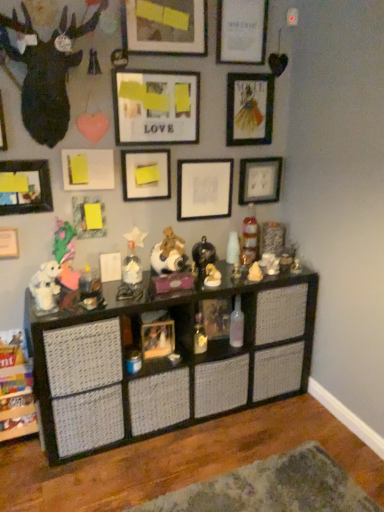
Where is `black matte picture frame at upper right, which is counted as the 8th picture frame, starting from the bottom`? The image size is (384, 512). black matte picture frame at upper right, which is counted as the 8th picture frame, starting from the bottom is located at coordinates (259, 180).

This screenshot has width=384, height=512. Describe the element at coordinates (156, 106) in the screenshot. I see `matte paper picture frame at upper center, which is the 10th picture frame in bottom-to-top order` at that location.

You are a GUI agent. You are given a task and a screenshot of the screen. Output one action in this format:
    pyautogui.click(x=<x>, y=<y>)
    Task: Click on the matte black picture frame at upper center, marked as the 12th picture frame in a bottom-to-top arrangement
    
    Given the screenshot: What is the action you would take?
    pyautogui.click(x=167, y=27)

Measure the distance between white matte dog at center, arranged as the fifth toy when viewed from the right, and camera.

The depth of white matte dog at center, arranged as the fifth toy when viewed from the right, is 7.10 feet.

Describe the element at coordinates (269, 264) in the screenshot. The width and height of the screenshot is (384, 512). I see `white matte figurine at center, acting as the eleventh toy starting from the left` at that location.

Identify the location of black matte picture frame at upper right, which is counted as the 8th picture frame, starting from the bottom. Image resolution: width=384 pixels, height=512 pixels. (259, 180).

Could you measure the distance between transparent glass bottle at center and shiny metallic figurine at center, marked as the sixth toy in a right-to-left arrangement?

transparent glass bottle at center is 32.13 centimeters from shiny metallic figurine at center, marked as the sixth toy in a right-to-left arrangement.

How different are the orientations of transparent glass bottle at center and shiny metallic figurine at center, marked as the sixth toy in a right-to-left arrangement, in degrees?

The angle between the facing direction of transparent glass bottle at center and the facing direction of shiny metallic figurine at center, marked as the sixth toy in a right-to-left arrangement, is 3.28 degrees.

Is transparent glass bottle at center not near shiny metallic figurine at center, marked as the sixth toy in a right-to-left arrangement?

No, transparent glass bottle at center is not far from shiny metallic figurine at center, marked as the sixth toy in a right-to-left arrangement.

Considering the relative sizes of transparent glass bottle at center and shiny metallic figurine at center, the sixth toy from the left, in the image provided, is transparent glass bottle at center bigger than shiny metallic figurine at center, the sixth toy from the left,?

No, transparent glass bottle at center is not bigger than shiny metallic figurine at center, the sixth toy from the left.

Based on the photo, from the image's perspective, is matte yellow paper at center, which is counted as the seventh picture frame, starting from the top, on top of brushed metal picture frame at upper left, the fifth picture frame in the top-to-bottom sequence?

No, from the image's perspective, matte yellow paper at center, which is counted as the seventh picture frame, starting from the top, is not above brushed metal picture frame at upper left, the fifth picture frame in the top-to-bottom sequence.

Does matte yellow paper at center, acting as the 7th picture frame starting from the bottom, have a greater height compared to brushed metal picture frame at upper left, which ranks as the ninth picture frame in bottom-to-top order?

Yes.

Which is closer, (x=145, y=189) or (x=2, y=125)?

The point (x=2, y=125) is more forward.

Could you tell me if matte yellow paper at center, which is counted as the seventh picture frame, starting from the top, is turned towards black matte picture frame at upper right, which ranks as the sixth picture frame in top-to-bottom order?

No.

The image size is (384, 512). Identify the location of the 1st picture frame positioned below the black matte picture frame at upper right, which is counted as the 8th picture frame, starting from the bottom (from the image's perspective). (146, 174).

Is matte yellow paper at center, which is counted as the seventh picture frame, starting from the top, at the right side of black matte picture frame at upper right, which is counted as the 8th picture frame, starting from the bottom?

Incorrect, matte yellow paper at center, which is counted as the seventh picture frame, starting from the top, is not on the right side of black matte picture frame at upper right, which is counted as the 8th picture frame, starting from the bottom.

Considering the sizes of objects matte yellow paper at center, acting as the 7th picture frame starting from the bottom, and black matte picture frame at upper right, which is counted as the 8th picture frame, starting from the bottom, in the image provided, who is shorter, matte yellow paper at center, acting as the 7th picture frame starting from the bottom, or black matte picture frame at upper right, which is counted as the 8th picture frame, starting from the bottom,?

matte yellow paper at center, acting as the 7th picture frame starting from the bottom.

Consider the image. Is wooden picture frame at center, the 2th picture frame from the bottom, looking in the opposite direction of wooden picture frame at center, which appears as the 1th picture frame when ordered from the bottom?

That's not correct — wooden picture frame at center, the 2th picture frame from the bottom, is not looking away from wooden picture frame at center, which appears as the 1th picture frame when ordered from the bottom.

Considering the relative positions of wooden picture frame at center, which is the 12th picture frame from top to bottom, and wooden picture frame at center, the thirteenth picture frame when ordered from top to bottom, in the image provided, is wooden picture frame at center, which is the 12th picture frame from top to bottom, in front of wooden picture frame at center, the thirteenth picture frame when ordered from top to bottom,?

No, the depth of wooden picture frame at center, which is the 12th picture frame from top to bottom, is greater than that of wooden picture frame at center, the thirteenth picture frame when ordered from top to bottom.

Looking at this image, measure the distance from wooden picture frame at center, the 2th picture frame from the bottom, to wooden picture frame at center, which appears as the 1th picture frame when ordered from the bottom.

The distance of wooden picture frame at center, the 2th picture frame from the bottom, from wooden picture frame at center, which appears as the 1th picture frame when ordered from the bottom, is 10.32 inches.

Do you think wooden picture frame at center, which is the 12th picture frame from top to bottom, is within wooden picture frame at center, the thirteenth picture frame when ordered from top to bottom, or outside of it?

The correct answer is: outside.

From the image's perspective, is white fabric stuffed animal at center, which ranks as the eighth toy in right-to-left order, positioned above or below matte white picture frame at upper center, the first picture frame from the top?

white fabric stuffed animal at center, which ranks as the eighth toy in right-to-left order, is below matte white picture frame at upper center, the first picture frame from the top.

Is white fabric stuffed animal at center, the 4th toy positioned from the left, touching matte white picture frame at upper center, the first picture frame from the top?

They are not placed beside each other.

Is point (157, 247) positioned in front of point (265, 3)?

No, it is behind (265, 3).

Considering their positions, is white fabric stuffed animal at center, which ranks as the eighth toy in right-to-left order, located in front of or behind matte white picture frame at upper center, the first picture frame from the top?

white fabric stuffed animal at center, which ranks as the eighth toy in right-to-left order, is positioned closer to the viewer than matte white picture frame at upper center, the first picture frame from the top.

Is fluffy pink stuffed animal at center-left, the 11th toy from the right, placed right next to matte white figurine at center, the 8th toy when ordered from left to right?

No, fluffy pink stuffed animal at center-left, the 11th toy from the right, is not with matte white figurine at center, the 8th toy when ordered from left to right.

Is fluffy pink stuffed animal at center-left, the 11th toy from the right, thinner than matte white figurine at center, the fourth toy when ordered from right to left?

No.

From a real-world perspective, count 3rd toys upward from the matte white figurine at center, the 8th toy when ordered from left to right, and point to it. Please provide its 2D coordinates.

[(65, 254)]

Consider the image. Which of these two, fluffy pink stuffed animal at center-left, the first toy from the left, or matte white figurine at center, the fourth toy when ordered from right to left, is smaller?

With smaller size is matte white figurine at center, the fourth toy when ordered from right to left.

From a real-world perspective, is matte black picture frame at left, placed as the 4th picture frame when sorted from bottom to top, positioned above or below blue plastic toy at center, which ranks as the ninth toy in right-to-left order?

matte black picture frame at left, placed as the 4th picture frame when sorted from bottom to top, is situated higher than blue plastic toy at center, which ranks as the ninth toy in right-to-left order, in the real world.

From the image's perspective, which one is positioned lower, matte black picture frame at left, placed as the 4th picture frame when sorted from bottom to top, or blue plastic toy at center, which is counted as the 3th toy, starting from the left?

blue plastic toy at center, which is counted as the 3th toy, starting from the left.

Can we say matte black picture frame at left, which is counted as the tenth picture frame, starting from the top, lies outside blue plastic toy at center, which ranks as the ninth toy in right-to-left order?

matte black picture frame at left, which is counted as the tenth picture frame, starting from the top, is positioned outside blue plastic toy at center, which ranks as the ninth toy in right-to-left order.

Locate an element on the screen. This screenshot has height=512, width=384. the 5th toy positioned above the transparent glass bottle at center (from the image's perspective) is located at coordinates (203, 258).

From the image's perspective, which picture frame is the 2nd one below the brushed metal picture frame at upper left, which ranks as the ninth picture frame in bottom-to-top order? Please provide its 2D coordinates.

[(146, 174)]

Based on their spatial positions, is blue plastic toy at center, which ranks as the ninth toy in right-to-left order, or transparent glass bottle at center closer to matte yellow paper at center, which is counted as the seventh picture frame, starting from the top?

transparent glass bottle at center is closer to matte yellow paper at center, which is counted as the seventh picture frame, starting from the top.

When comparing their distances from matte white picture frame at lower left, the eleventh picture frame positioned from the top, does wooden picture frame at center, which appears as the 1th picture frame when ordered from the bottom, or matte paper picture frame at upper center, marked as the 4th picture frame in a top-to-bottom arrangement, seem closer?

Based on the image, wooden picture frame at center, which appears as the 1th picture frame when ordered from the bottom, appears to be nearer to matte white picture frame at lower left, the eleventh picture frame positioned from the top.

Which object lies further to the anchor point matte black picture frame at upper right, marked as the third picture frame in a top-to-bottom arrangement, transparent glass bottle at center or matte black deer head at upper left?

The object further to matte black picture frame at upper right, marked as the third picture frame in a top-to-bottom arrangement, is transparent glass bottle at center.

Estimate the real-world distances between objects in this image. Which object is closer to matte white picture frame at upper center, which is counted as the 13th picture frame, starting from the bottom, clear plastic bottle at center, which appears as the second toy when viewed from the right, or matte yellow cone at center, the third toy when ordered from right to left?

clear plastic bottle at center, which appears as the second toy when viewed from the right.

When comparing their distances from matte yellow paper at center, which is counted as the seventh picture frame, starting from the top, does transparent glass bottle at center or black woven shelf at center seem closer?

The object closer to matte yellow paper at center, which is counted as the seventh picture frame, starting from the top, is black woven shelf at center.

Based on their spatial positions, is matte white figurine at center, the 8th toy when ordered from left to right, or shiny metallic figurine at center, the sixth toy from the left, further from matte white picture frame at lower left, positioned as the third picture frame in bottom-to-top order?

matte white figurine at center, the 8th toy when ordered from left to right, lies further to matte white picture frame at lower left, positioned as the third picture frame in bottom-to-top order, than the other object.

From the image, which object appears to be nearer to matte black picture frame at upper right, which is the eleventh picture frame from bottom to top, clear plastic bottle at center, the tenth toy when ordered from left to right, or matte black picture frame at upper center, placed as the 2th picture frame when sorted from top to bottom?

matte black picture frame at upper center, placed as the 2th picture frame when sorted from top to bottom.

Estimate the real-world distances between objects in this image. Which object is closer to matte black picture frame at upper right, which is the eleventh picture frame from bottom to top, black matte picture frame at upper right, which ranks as the sixth picture frame in top-to-bottom order, or wooden picture frame at center, which appears as the 1th picture frame when ordered from the bottom?

Among the two, black matte picture frame at upper right, which ranks as the sixth picture frame in top-to-bottom order, is located nearer to matte black picture frame at upper right, which is the eleventh picture frame from bottom to top.

Identify the location of picture frame between white fabric stuffed animal at center, the 4th toy positioned from the left, and wooden picture frame at center, the thirteenth picture frame when ordered from top to bottom, from top to bottom. (216, 317).

Where is `toy between black matte picture frame at upper right, which is counted as the 8th picture frame, starting from the bottom, and matte white figurine at center, the 8th toy when ordered from left to right, in the up-down direction`? toy between black matte picture frame at upper right, which is counted as the 8th picture frame, starting from the bottom, and matte white figurine at center, the 8th toy when ordered from left to right, in the up-down direction is located at coordinates (249, 234).

This screenshot has height=512, width=384. Identify the location of toy that lies between white matte dog at center, which appears as the seventh toy when viewed from the left, and blue plastic toy at center, which ranks as the ninth toy in right-to-left order, from top to bottom. (200, 335).

Locate an element on the screen. The height and width of the screenshot is (512, 384). bottle between matte white picture frame at lower left, positioned as the third picture frame in bottom-to-top order, and white matte figurine at center, acting as the eleventh toy starting from the left is located at coordinates (236, 325).